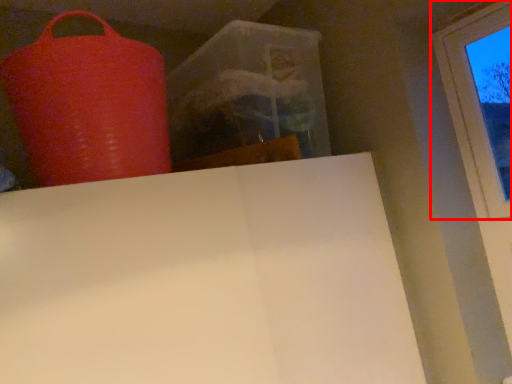
Question: From the image's perspective, what is the correct spatial relationship of window (annotated by the red box) in relation to punching bag?

Choices:
 (A) below
 (B) above

Answer: (A)